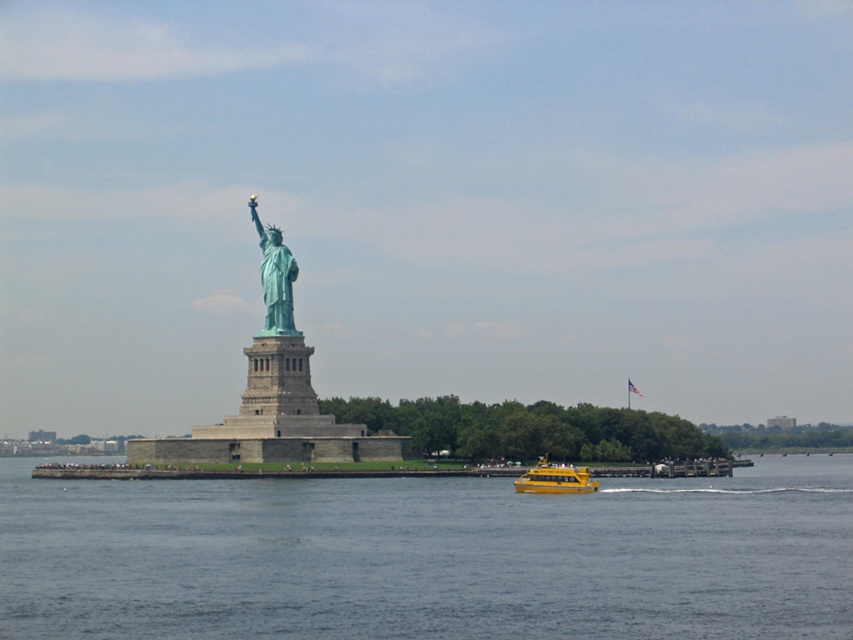
You are a tourist standing on the dock and see the green patina statue at center and the yellow plastic boat at lower center. Which object is located to the right of the other?

The yellow plastic boat at lower center is located to the right of the green patina statue at center because the green patina statue at center is positioned on the left side of the yellow plastic boat at lower center.

You are a photographer planning to take a picture of the green patina statue at center and the yellow plastic boat at lower center. You want to ensure the statue appears larger in the photo than the boat. Based on the scene, will this be possible?

The green patina statue at center has a greater height compared to the yellow plastic boat at lower center, so yes, the statue will appear larger in the photo than the boat.

You are a photographer planning to take a photo of the Statue of Liberty. You want to ensure that both the blue water at center and the yellow plastic boat at lower center are clearly visible in the frame. Which object should you focus on first to ensure they are both in focus?

The blue water at center has a larger width than the yellow plastic boat at lower center, so focusing on the blue water at center first will help ensure both objects are in focus.